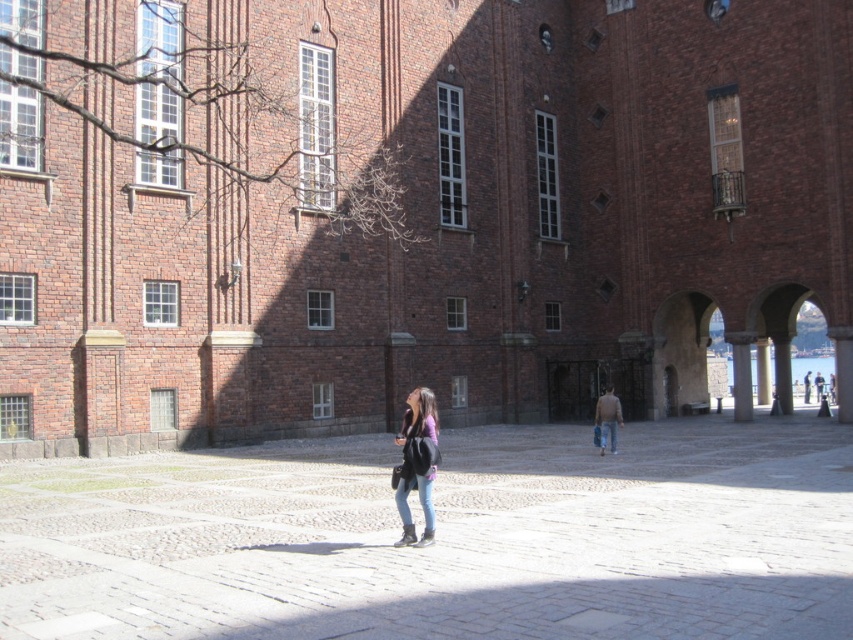
You are standing in front of the historic brick building and notice two points marked on the cobblestone path. The first point is at coordinates point (616, 419) and the second is at point (809, 388). Which point is nearer to you?

Point (616, 419) is closer to the viewer than point (809, 388).

You are standing at the center of the scene and see both the light brown sweater at center and the denim jacket at center. Which one is closer to you?

Both the light brown sweater at center and the denim jacket at center are at the same distance from you since they are both located at the center of the scene.

You are standing in front of the historic brick building and see the smooth stone courtyard at center and the light brown sweater at center. Which object is taller?

The light brown sweater at center is taller than the smooth stone courtyard at center.